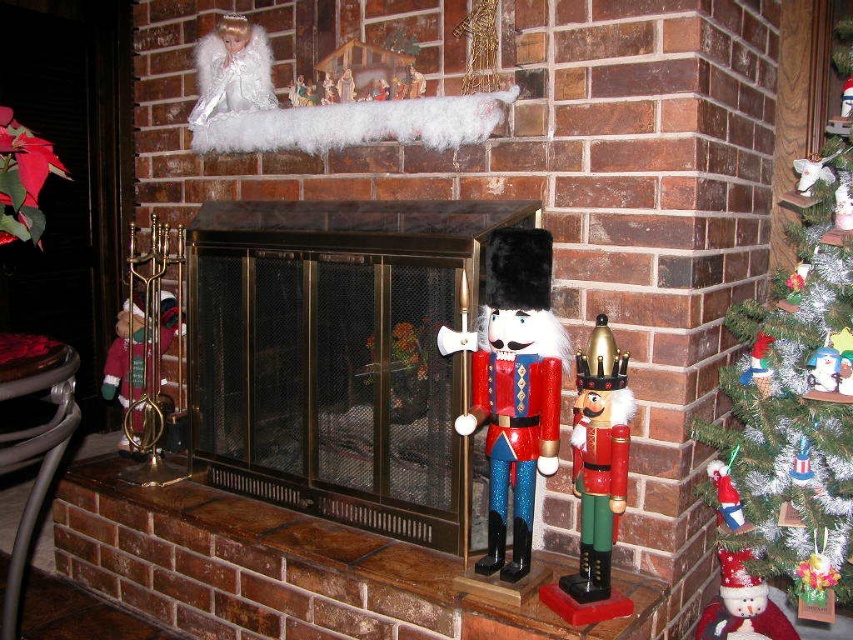
Can you confirm if wooden nutcracker at center is positioned to the right of wooden nutcracker at right?

No, wooden nutcracker at center is not to the right of wooden nutcracker at right.

Which is below, wooden nutcracker at center or wooden nutcracker at right?

wooden nutcracker at right is lower down.

Is point (497, 250) closer to camera compared to point (605, 336)?

No, (497, 250) is behind (605, 336).

This screenshot has width=853, height=640. I want to click on wooden nutcracker at center, so click(x=514, y=387).

Is metallic gold fireplace at center bigger than wooden nutcracker at center?

Yes.

Is point (218, 438) positioned in front of point (498, 548)?

No, (218, 438) is behind (498, 548).

Who is more distant from viewer, (421, 224) or (567, 349)?

Point (421, 224)

I want to click on metallic gold fireplace at center, so click(x=341, y=356).

Is metallic gold fireplace at center bigger than frosted glass christmas tree at right?

Indeed, metallic gold fireplace at center has a larger size compared to frosted glass christmas tree at right.

Is metallic gold fireplace at center smaller than frosted glass christmas tree at right?

Actually, metallic gold fireplace at center might be larger than frosted glass christmas tree at right.

The height and width of the screenshot is (640, 853). Find the location of `metallic gold fireplace at center`. metallic gold fireplace at center is located at coordinates (341, 356).